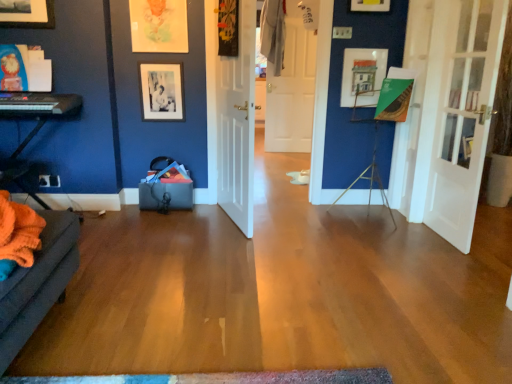
The height and width of the screenshot is (384, 512). I want to click on free space between white wooden door at center, the third door positioned from the right, and multicolored woven mat at lower center, so click(206, 312).